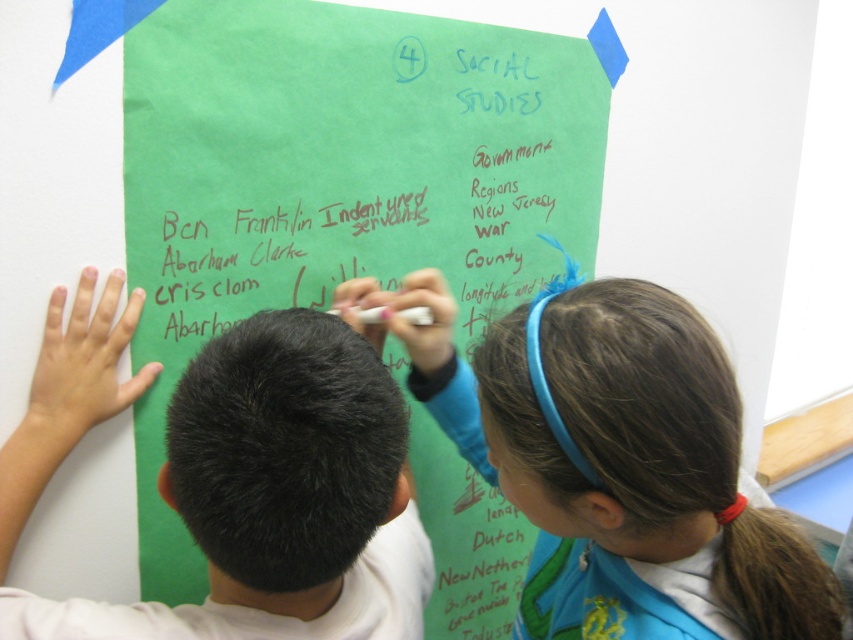
You are a teacher observing two students in the classroom. You notice the light brown hair at upper center and the black hair at center. Which student has hair that appears larger in the image?

The light brown hair at upper center is bigger than the black hair at center in the image.

What is located at the coordinates point (339, 179)?

The green paper at center is located at point (339, 179).